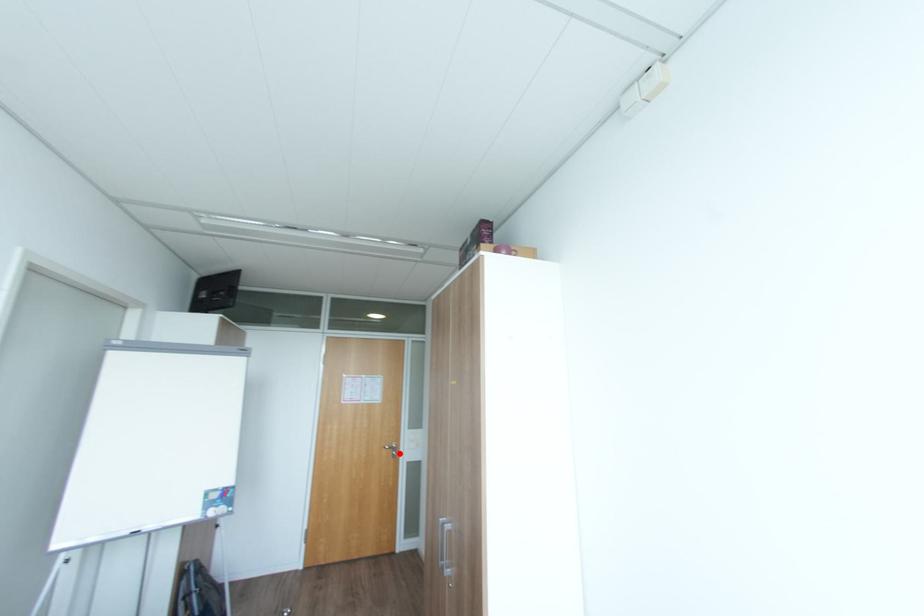
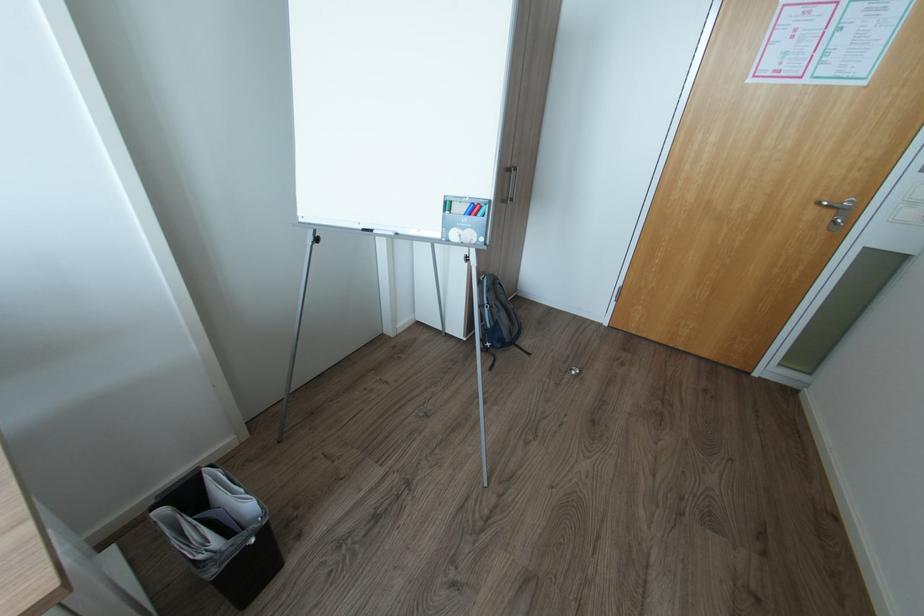
Question: I am providing you with two images of the same scene from different viewpoints. In image1, a red point is highlighted. Considering the same 3D point in image2, which of the following is correct?

Choices:
 (A) It is closer
 (B) It is farther

Answer: (A)